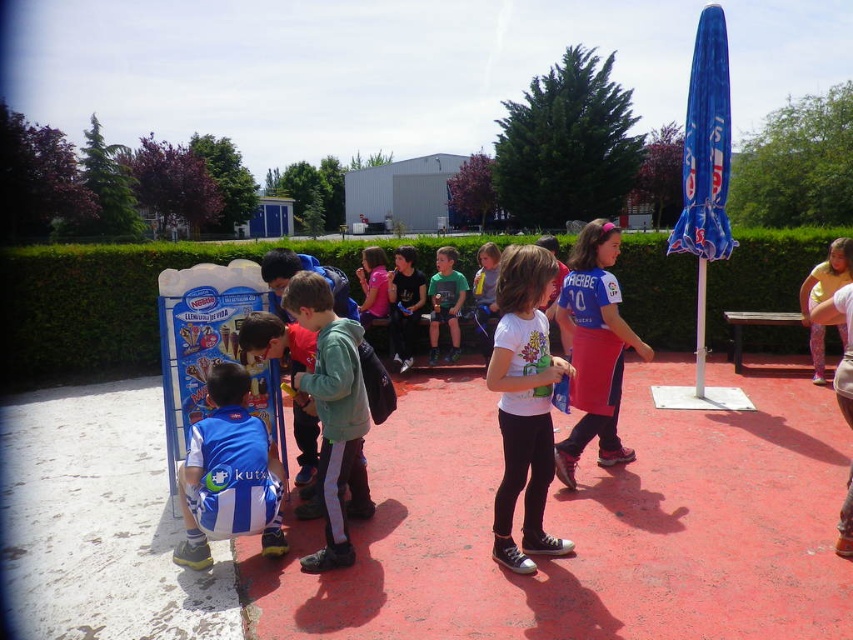
Is point (549, 353) positioned behind point (439, 269)?

No, (549, 353) is closer to viewer.

This screenshot has height=640, width=853. Find the location of `white matte t-shirt at center`. white matte t-shirt at center is located at coordinates (524, 404).

The image size is (853, 640). What do you see at coordinates (524, 404) in the screenshot?
I see `white matte t-shirt at center` at bounding box center [524, 404].

Where is `white matte t-shirt at center`? This screenshot has height=640, width=853. white matte t-shirt at center is located at coordinates (524, 404).

Does green hedge at lower left appear on the left side of pink fabric apron at center?

No, green hedge at lower left is not to the left of pink fabric apron at center.

Is green hedge at lower left smaller than pink fabric apron at center?

No.

Measure the distance between green hedge at lower left and camera.

green hedge at lower left and camera are 8.56 meters apart.

I want to click on green hedge at lower left, so click(91, 305).

Can you confirm if green hedge at lower left is taller than green matte shirt at center?

Correct, green hedge at lower left is much taller as green matte shirt at center.

Who is higher up, green hedge at lower left or green matte shirt at center?

Positioned higher is green hedge at lower left.

Describe the element at coordinates (91, 305) in the screenshot. I see `green hedge at lower left` at that location.

Image resolution: width=853 pixels, height=640 pixels. I want to click on green hedge at lower left, so click(91, 305).